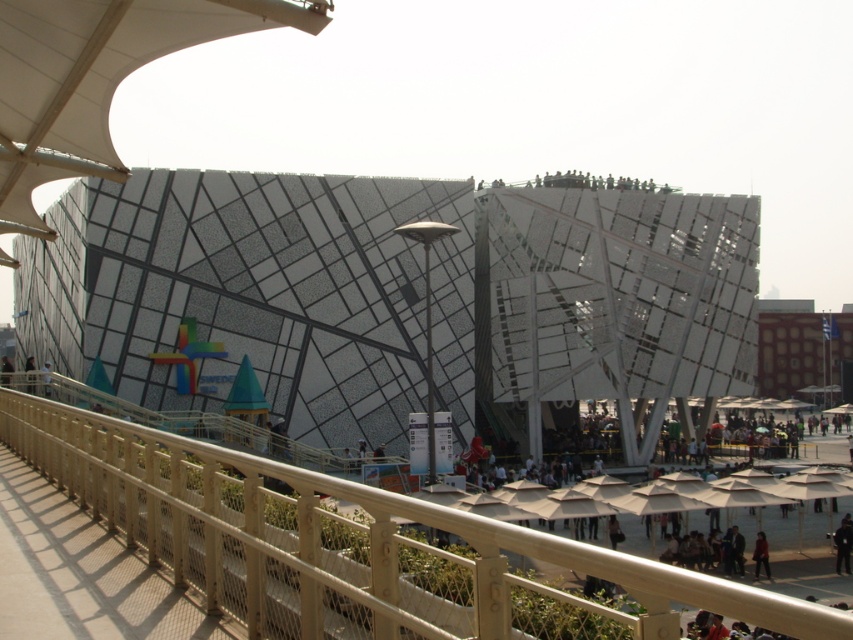
You are a visitor at this modern building and want to take a photo of the dark red fabric at lower right and the white fabric umbrella at center. Which object should you focus on first if you want to capture both in the frame without moving the camera?

You should focus on the dark red fabric at lower right first because it is taller than the white fabric umbrella at center, so it will occupy more space in the frame and ensure both are visible without needing to adjust the camera position.

You are standing on the walkway in front of the modern building and see the white fabric canopy at upper left and the dark brown leather jacket at upper left. Which object is located above the other?

The white fabric canopy at upper left is positioned over the dark brown leather jacket at upper left, so the canopy is above the jacket.